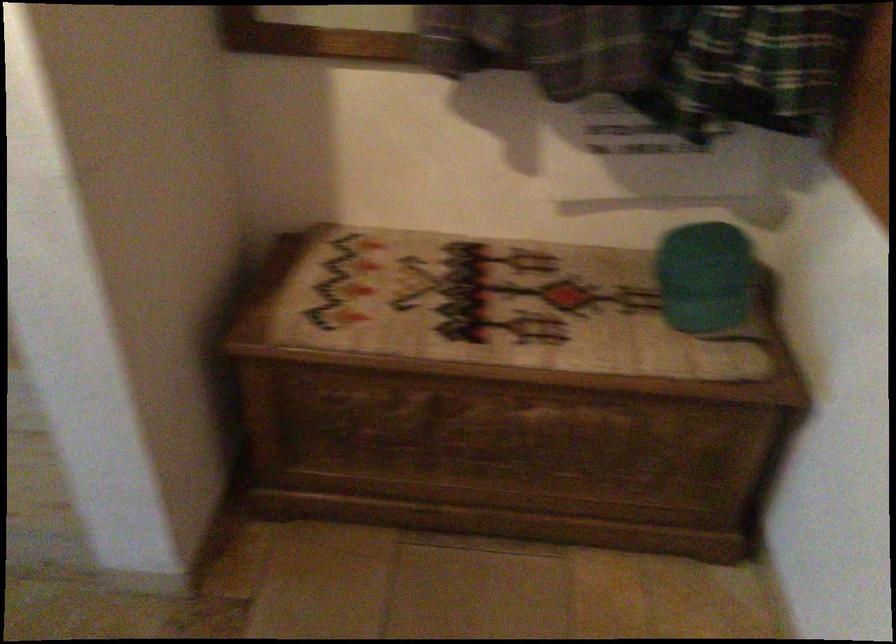
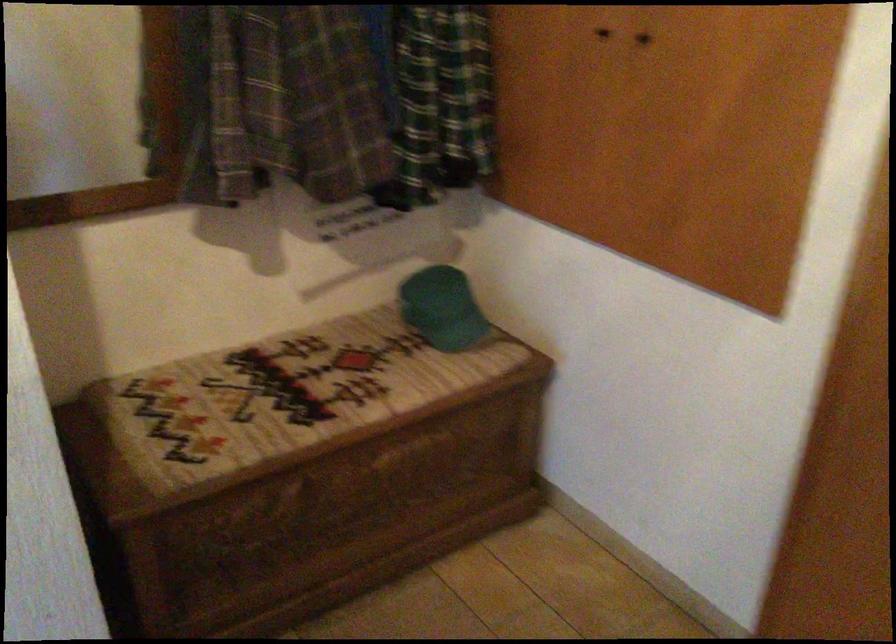
Question: How did the camera likely rotate?

Choices:
 (A) Left
 (B) Right
 (C) Up
 (D) Down

Answer: (B)